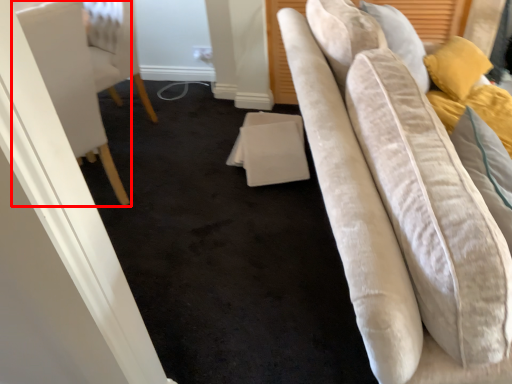
Question: From the image's perspective, where is furniture (annotated by the red box) located in relation to table in the image?

Choices:
 (A) above
 (B) below

Answer: (A)